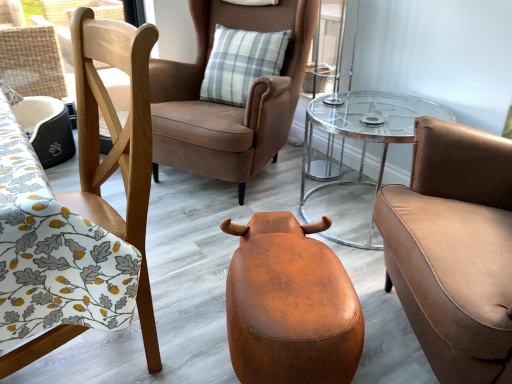
Question: Is clear glass table at center bigger than brown leather chair at center, marked as the 2th chair in a right-to-left arrangement?

Choices:
 (A) yes
 (B) no

Answer: (B)

Question: Could brown leather chair at center, positioned as the second chair in left-to-right order, be considered to be inside clear glass table at center?

Choices:
 (A) yes
 (B) no

Answer: (B)

Question: Does clear glass table at center have a greater width compared to brown leather chair at center, marked as the 2th chair in a right-to-left arrangement?

Choices:
 (A) yes
 (B) no

Answer: (B)

Question: Considering the relative positions of clear glass table at center and brown leather chair at center, positioned as the second chair in left-to-right order, in the image provided, is clear glass table at center to the left of brown leather chair at center, positioned as the second chair in left-to-right order, from the viewer's perspective?

Choices:
 (A) no
 (B) yes

Answer: (A)

Question: Can you confirm if clear glass table at center is smaller than brown leather chair at center, marked as the 2th chair in a right-to-left arrangement?

Choices:
 (A) yes
 (B) no

Answer: (A)

Question: Is matte brown leather armchair at right, positioned as the 3th chair in left-to-right order, bigger or smaller than clear glass table at center?

Choices:
 (A) small
 (B) big

Answer: (B)

Question: Which is correct: matte brown leather armchair at right, marked as the first chair in a right-to-left arrangement, is inside clear glass table at center, or outside of it?

Choices:
 (A) outside
 (B) inside

Answer: (A)

Question: In terms of height, does matte brown leather armchair at right, positioned as the 3th chair in left-to-right order, look taller or shorter compared to clear glass table at center?

Choices:
 (A) tall
 (B) short

Answer: (A)

Question: Does point (454, 306) appear closer or farther from the camera than point (420, 109)?

Choices:
 (A) closer
 (B) farther

Answer: (A)

Question: Is matte brown leather armchair at right, positioned as the 3th chair in left-to-right order, wider or thinner than leather ottoman at center?

Choices:
 (A) thin
 (B) wide

Answer: (B)

Question: Is matte brown leather armchair at right, positioned as the 3th chair in left-to-right order, situated inside leather ottoman at center or outside?

Choices:
 (A) inside
 (B) outside

Answer: (B)

Question: In the image, is matte brown leather armchair at right, marked as the first chair in a right-to-left arrangement, positioned in front of or behind leather ottoman at center?

Choices:
 (A) behind
 (B) front

Answer: (B)

Question: From the image's perspective, is matte brown leather armchair at right, marked as the first chair in a right-to-left arrangement, above or below leather ottoman at center?

Choices:
 (A) below
 (B) above

Answer: (B)

Question: From the image's perspective, is leather ottoman at center located above or below brown leather chair at center, marked as the 2th chair in a right-to-left arrangement?

Choices:
 (A) above
 (B) below

Answer: (B)

Question: Looking at the image, does leather ottoman at center seem bigger or smaller compared to brown leather chair at center, positioned as the second chair in left-to-right order?

Choices:
 (A) big
 (B) small

Answer: (B)